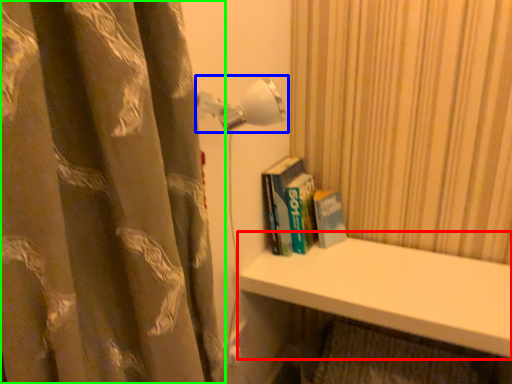
Question: Which object is the closest to the window sill (highlighted by a red box)? Choose among these: lamp (highlighted by a blue box) or curtain (highlighted by a green box).

Choices:
 (A) lamp
 (B) curtain

Answer: (A)